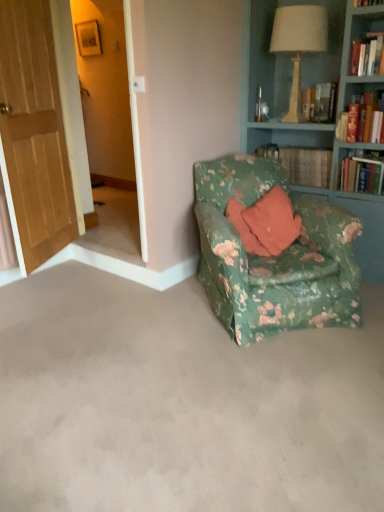
Question: Can you confirm if wooden door at left is taller than green floral fabric chair at lower right?

Choices:
 (A) no
 (B) yes

Answer: (B)

Question: Is wooden door at left positioned before green floral fabric chair at lower right?

Choices:
 (A) no
 (B) yes

Answer: (A)

Question: Would you say wooden door at left is a long distance from green floral fabric chair at lower right?

Choices:
 (A) yes
 (B) no

Answer: (A)

Question: Are wooden door at left and green floral fabric chair at lower right making contact?

Choices:
 (A) yes
 (B) no

Answer: (B)

Question: Does wooden door at left turn towards green floral fabric chair at lower right?

Choices:
 (A) no
 (B) yes

Answer: (B)

Question: From the image's perspective, is hardcover book at upper right, the 2th book in the front-to-back sequence, above or below matte beige lampshade at upper right?

Choices:
 (A) below
 (B) above

Answer: (A)

Question: Considering the positions of hardcover book at upper right, marked as the 2th book in a back-to-front arrangement, and matte beige lampshade at upper right in the image, is hardcover book at upper right, marked as the 2th book in a back-to-front arrangement, wider or thinner than matte beige lampshade at upper right?

Choices:
 (A) thin
 (B) wide

Answer: (A)

Question: In terms of height, does hardcover book at upper right, marked as the 2th book in a back-to-front arrangement, look taller or shorter compared to matte beige lampshade at upper right?

Choices:
 (A) short
 (B) tall

Answer: (A)

Question: Is point (375, 160) closer or farther from the camera than point (292, 71)?

Choices:
 (A) closer
 (B) farther

Answer: (A)

Question: Is green floral fabric chair at lower right bigger or smaller than wooden screen door at left?

Choices:
 (A) big
 (B) small

Answer: (A)

Question: Is point (79, 416) closer or farther from the camera than point (97, 17)?

Choices:
 (A) closer
 (B) farther

Answer: (A)

Question: From a real-world perspective, is green floral fabric chair at lower right above or below wooden screen door at left?

Choices:
 (A) above
 (B) below

Answer: (B)

Question: Considering the positions of green floral fabric chair at lower right and wooden screen door at left in the image, is green floral fabric chair at lower right taller or shorter than wooden screen door at left?

Choices:
 (A) tall
 (B) short

Answer: (B)

Question: Is wooden screen door at left in front of or behind green floral fabric chair at lower right in the image?

Choices:
 (A) front
 (B) behind

Answer: (B)

Question: Is point tap(132, 182) positioned closer to the camera than point tap(246, 461)?

Choices:
 (A) farther
 (B) closer

Answer: (A)